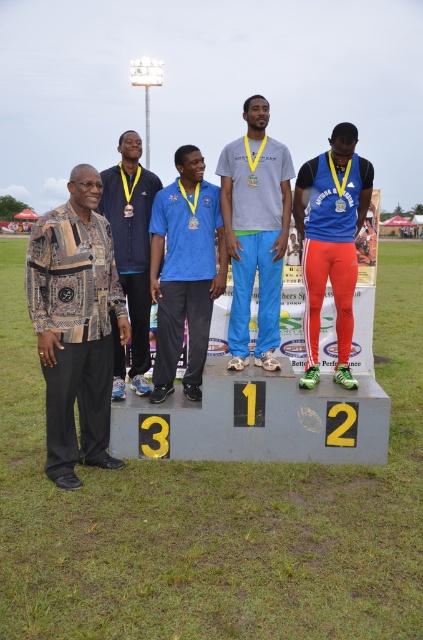
From the picture: You are a photographer at the event and need to adjust your camera angle to ensure both the blue synthetic track suit at center and the navy blue jacket at left are fully visible in the photo. Which object should you focus on first to avoid cropping either of them?

The navy blue jacket at left is taller than the blue synthetic track suit at center, so focusing on the navy blue jacket at left first will ensure both are fully visible.